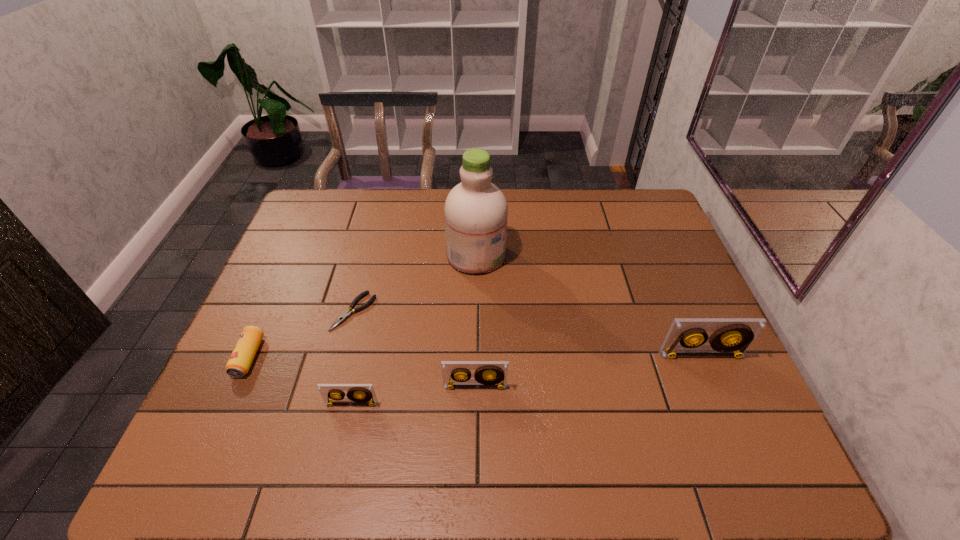
The width and height of the screenshot is (960, 540). Identify the location of vacant space that satisfies the following two spatial constraints: 1. on the front label of the tallest object; 2. at the front of the nearest object with visible reels. (474, 404).

This screenshot has width=960, height=540. Identify the location of free space in the image that satisfies the following two spatial constraints: 1. on the front label of the tallest object; 2. at the front of the nearest object with visible reels. (474, 404).